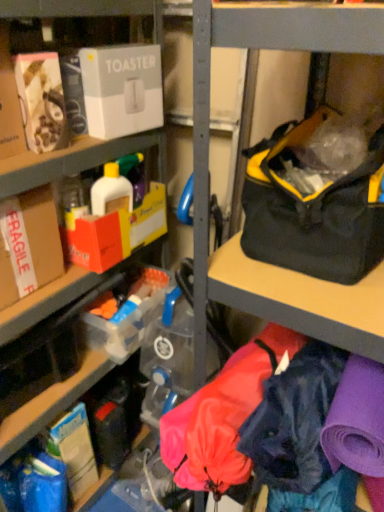
Question: Is white cardboard toaster at upper left, acting as the second box starting from the left, closer to the viewer compared to black/yellow fabric bag at right?

Choices:
 (A) no
 (B) yes

Answer: (A)

Question: Is white cardboard toaster at upper left, acting as the second box starting from the left, smaller than black/yellow fabric bag at right?

Choices:
 (A) no
 (B) yes

Answer: (B)

Question: Considering the relative positions of white cardboard toaster at upper left, the 1th box from the right, and black/yellow fabric bag at right in the image provided, is white cardboard toaster at upper left, the 1th box from the right, to the right of black/yellow fabric bag at right from the viewer's perspective?

Choices:
 (A) yes
 (B) no

Answer: (B)

Question: Does white cardboard toaster at upper left, the second box positioned from the bottom, come behind black/yellow fabric bag at right?

Choices:
 (A) yes
 (B) no

Answer: (A)

Question: Can you confirm if white cardboard toaster at upper left, the second box positioned from the bottom, is taller than black/yellow fabric bag at right?

Choices:
 (A) yes
 (B) no

Answer: (B)

Question: From a real-world perspective, is white cardboard toaster at upper left, arranged as the first box when viewed from the top, physically located above or below brown cardboard box at left, which is the first box from left to right?

Choices:
 (A) below
 (B) above

Answer: (B)

Question: Is white cardboard toaster at upper left, acting as the second box starting from the left, inside or outside of brown cardboard box at left, which is the second box in top-to-bottom order?

Choices:
 (A) inside
 (B) outside

Answer: (B)

Question: Based on their sizes in the image, would you say white cardboard toaster at upper left, the 1th box from the right, is bigger or smaller than brown cardboard box at left, positioned as the first box in bottom-to-top order?

Choices:
 (A) small
 (B) big

Answer: (A)

Question: Considering the positions of point (127, 124) and point (18, 239), is point (127, 124) closer or farther from the camera than point (18, 239)?

Choices:
 (A) closer
 (B) farther

Answer: (B)

Question: In the image, is black/yellow fabric bag at right on the left side or the right side of brown cardboard box at left, which is the first box from left to right?

Choices:
 (A) right
 (B) left

Answer: (A)

Question: In terms of height, does black/yellow fabric bag at right look taller or shorter compared to brown cardboard box at left, which is the first box from left to right?

Choices:
 (A) tall
 (B) short

Answer: (A)

Question: From a real-world perspective, is black/yellow fabric bag at right positioned above or below brown cardboard box at left, which is the second box in right-to-left order?

Choices:
 (A) below
 (B) above

Answer: (B)

Question: Considering the positions of point (301, 200) and point (43, 276), is point (301, 200) closer or farther from the camera than point (43, 276)?

Choices:
 (A) farther
 (B) closer

Answer: (B)

Question: Is matte black toaster at upper left bigger or smaller than white cardboard toaster at upper left, the second box positioned from the bottom?

Choices:
 (A) small
 (B) big

Answer: (B)

Question: Is matte black toaster at upper left to the left or to the right of white cardboard toaster at upper left, arranged as the first box when viewed from the top, in the image?

Choices:
 (A) left
 (B) right

Answer: (A)